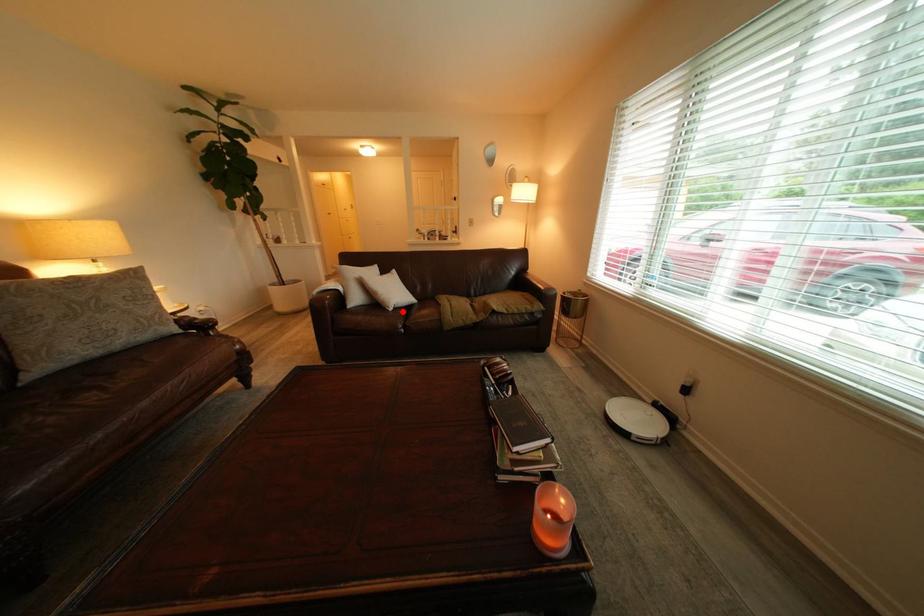
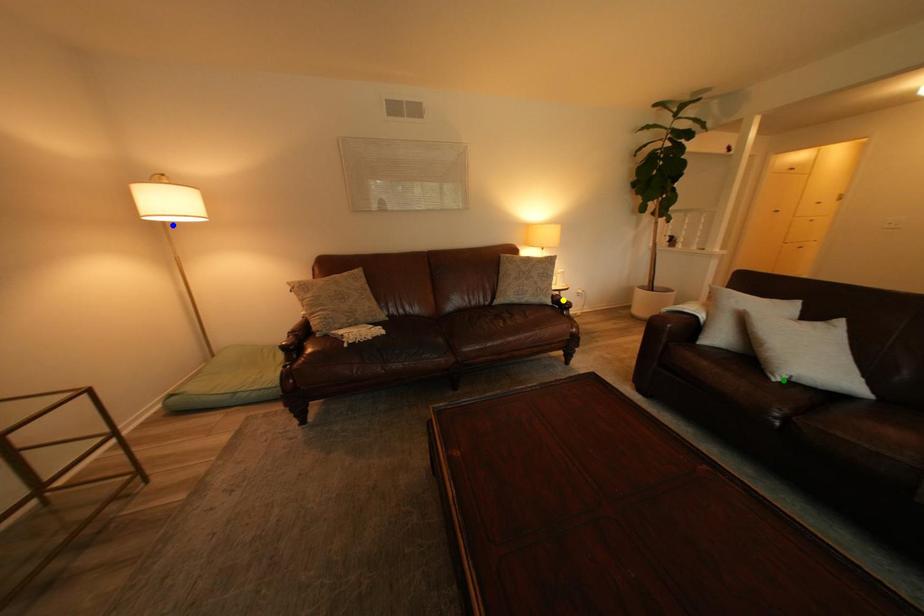
Question: I am providing you with two images of the same scene from different viewpoints. A red point is marked on the first image. You are given multiple points on the second image. Which point in image 2 represents the same 3d spot as the red point in image 1?

Choices:
 (A) green point
 (B) blue point
 (C) yellow point

Answer: (A)